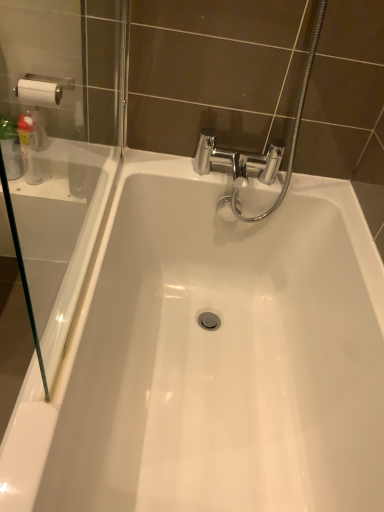
In order to click on translucent plastic bottle at left in this screenshot , I will do `click(29, 149)`.

The width and height of the screenshot is (384, 512). What do you see at coordinates (59, 149) in the screenshot?
I see `transparent glass screen door at left` at bounding box center [59, 149].

Where is `translucent plastic bottle at left`? translucent plastic bottle at left is located at coordinates (29, 149).

I want to click on screen door on the left of white glossy bathtub at center, so click(x=59, y=149).

From the image's perspective, relative to transparent glass screen door at left, is white glossy bathtub at center above or below?

Based on their image positions, white glossy bathtub at center is located beneath transparent glass screen door at left.

From a real-world perspective, is white glossy bathtub at center beneath transparent glass screen door at left?

Yes, from a real-world perspective, white glossy bathtub at center is under transparent glass screen door at left.

Looking at this image, is white glossy bathtub at center oriented away from transparent glass screen door at left?

No, white glossy bathtub at center's orientation is not away from transparent glass screen door at left.

Considering the relative sizes of transparent glass screen door at left and translucent plastic bottle at left in the image provided, is transparent glass screen door at left shorter than translucent plastic bottle at left?

No.

Is the surface of transparent glass screen door at left in direct contact with translucent plastic bottle at left?

There is a gap between transparent glass screen door at left and translucent plastic bottle at left.

Is translucent plastic bottle at left surrounded by transparent glass screen door at left?

That's incorrect, translucent plastic bottle at left is not inside transparent glass screen door at left.

Based on the photo, from a real-world perspective, who is located lower, white glossy bathtub at center or translucent plastic bottle at left?

Result: white glossy bathtub at center, from a real-world perspective.

Looking at their sizes, would you say white glossy bathtub at center is wider or thinner than translucent plastic bottle at left?

Considering their sizes, white glossy bathtub at center looks broader than translucent plastic bottle at left.

Do you think white glossy bathtub at center is within translucent plastic bottle at left, or outside of it?

white glossy bathtub at center lies outside translucent plastic bottle at left.

Would you say white glossy bathtub at center is a long distance from translucent plastic bottle at left?

white glossy bathtub at center is actually quite close to translucent plastic bottle at left.

Considering the relative sizes of translucent plastic bottle at left and transparent glass screen door at left in the image provided, is translucent plastic bottle at left taller than transparent glass screen door at left?

No.

Is translucent plastic bottle at left far from transparent glass screen door at left?

That's not correct — translucent plastic bottle at left is a little close to transparent glass screen door at left.

Based on the photo, is translucent plastic bottle at left behind transparent glass screen door at left?

Yes, translucent plastic bottle at left is behind transparent glass screen door at left.

Between translucent plastic bottle at left and white glossy bathtub at center, which one is positioned in front?

Positioned in front is white glossy bathtub at center.

Can you confirm if translucent plastic bottle at left is taller than white glossy bathtub at center?

No, translucent plastic bottle at left is not taller than white glossy bathtub at center.

From the image's perspective, which one is positioned higher, translucent plastic bottle at left or white glossy bathtub at center?

translucent plastic bottle at left.

From the picture: From a real-world perspective, is translucent plastic bottle at left on white glossy bathtub at center?

Indeed, from a real-world perspective, translucent plastic bottle at left stands above white glossy bathtub at center.

Is transparent glass screen door at left completely or partially outside of white glossy bathtub at center?

transparent glass screen door at left lies outside white glossy bathtub at center's area.

Can you confirm if transparent glass screen door at left is thinner than white glossy bathtub at center?

Indeed, transparent glass screen door at left has a lesser width compared to white glossy bathtub at center.

Is transparent glass screen door at left oriented towards white glossy bathtub at center?

No, transparent glass screen door at left is not facing towards white glossy bathtub at center.

Considering the relative sizes of transparent glass screen door at left and white glossy bathtub at center in the image provided, is transparent glass screen door at left shorter than white glossy bathtub at center?

Correct, transparent glass screen door at left is not as tall as white glossy bathtub at center.

This screenshot has height=512, width=384. I want to click on screen door on the left of white glossy bathtub at center, so click(59, 149).

Locate an element on the screen. screen door below the translucent plastic bottle at left (from the image's perspective) is located at coordinates (59, 149).

Considering their positions, is transparent glass screen door at left positioned further to translucent plastic bottle at left than white glossy bathtub at center?

The object further to translucent plastic bottle at left is white glossy bathtub at center.

From the image, which object appears to be nearer to white glossy bathtub at center, transparent glass screen door at left or translucent plastic bottle at left?

transparent glass screen door at left is positioned closer to the anchor white glossy bathtub at center.

Estimate the real-world distances between objects in this image. Which object is closer to transparent glass screen door at left, white glossy bathtub at center or translucent plastic bottle at left?

translucent plastic bottle at left.

From the image, which object appears to be nearer to transparent glass screen door at left, translucent plastic bottle at left or white glossy bathtub at center?

translucent plastic bottle at left is closer to transparent glass screen door at left.

Based on the photo, which object lies nearer to the anchor point white glossy bathtub at center, translucent plastic bottle at left or transparent glass screen door at left?

transparent glass screen door at left.

Estimate the real-world distances between objects in this image. Which object is further from translucent plastic bottle at left, white glossy bathtub at center or transparent glass screen door at left?

white glossy bathtub at center is further to translucent plastic bottle at left.

I want to click on bathtub between transparent glass screen door at left and translucent plastic bottle at left along the z-axis, so click(x=223, y=352).